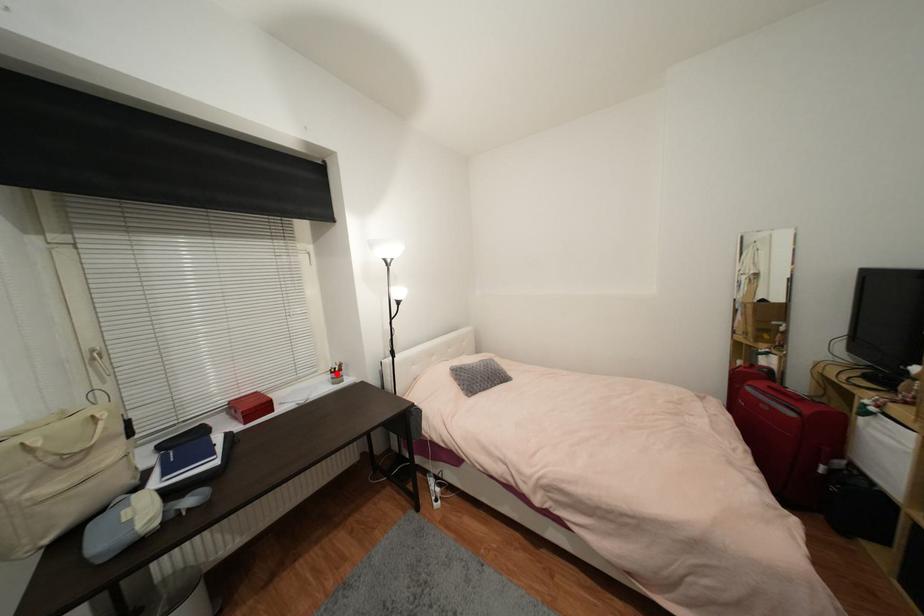
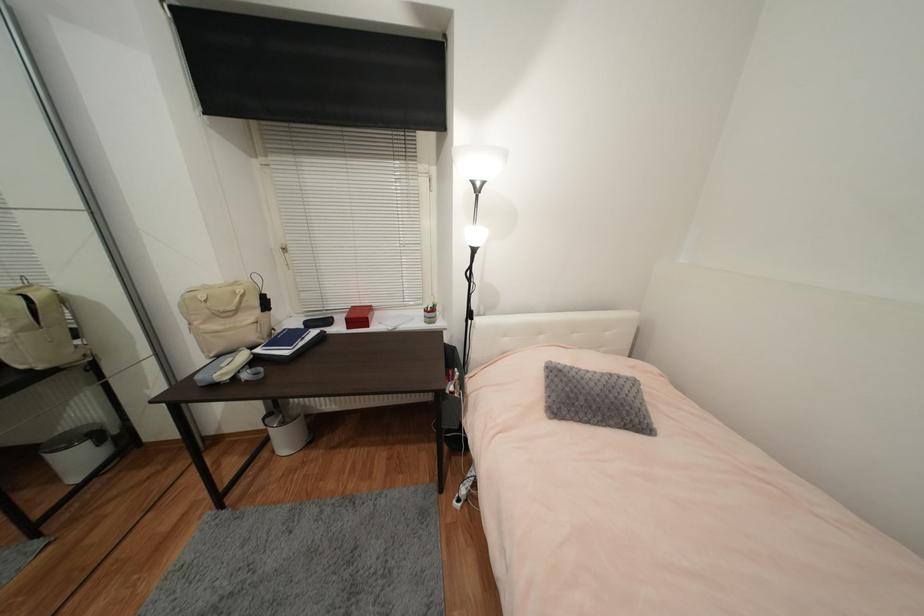
Locate, in the second image, the point that corresponds to the highlighted location in the first image.

(430, 312)